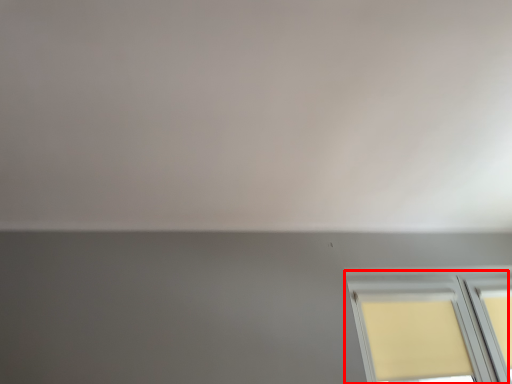
Question: Where is window (annotated by the red box) located in relation to backdrop in the image?

Choices:
 (A) right
 (B) left

Answer: (A)